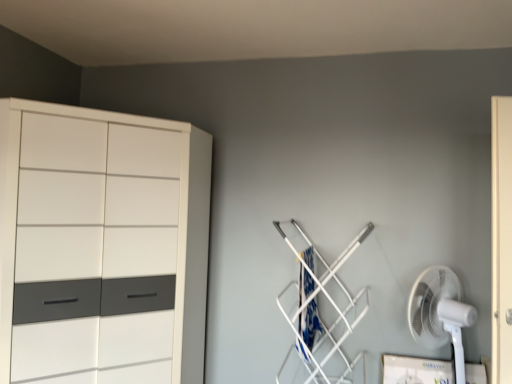
Question: From a real-world perspective, is white plastic fan at lower right under white glossy cupboard at left?

Choices:
 (A) no
 (B) yes

Answer: (B)

Question: Is white plastic fan at lower right located outside white glossy cupboard at left?

Choices:
 (A) yes
 (B) no

Answer: (A)

Question: Is white plastic fan at lower right not close to white glossy cupboard at left?

Choices:
 (A) yes
 (B) no

Answer: (A)

Question: Considering the relative sizes of white plastic fan at lower right and white glossy cupboard at left in the image provided, is white plastic fan at lower right wider than white glossy cupboard at left?

Choices:
 (A) yes
 (B) no

Answer: (B)

Question: Considering the relative sizes of white plastic fan at lower right and white glossy cupboard at left in the image provided, is white plastic fan at lower right smaller than white glossy cupboard at left?

Choices:
 (A) no
 (B) yes

Answer: (B)

Question: Looking at their shapes, would you say blue fabric laundry at center-right is wider or thinner than white plastic fan at lower right?

Choices:
 (A) wide
 (B) thin

Answer: (A)

Question: From the image's perspective, is blue fabric laundry at center-right above or below white plastic fan at lower right?

Choices:
 (A) above
 (B) below

Answer: (A)

Question: Considering the positions of blue fabric laundry at center-right and white plastic fan at lower right in the image, is blue fabric laundry at center-right taller or shorter than white plastic fan at lower right?

Choices:
 (A) short
 (B) tall

Answer: (A)

Question: Is point (313, 302) positioned closer to the camera than point (432, 332)?

Choices:
 (A) farther
 (B) closer

Answer: (A)

Question: From the image's perspective, is white plastic fan at lower right located above or below white glossy cupboard at left?

Choices:
 (A) below
 (B) above

Answer: (A)

Question: In the image, is white plastic fan at lower right positioned in front of or behind white glossy cupboard at left?

Choices:
 (A) behind
 (B) front

Answer: (A)

Question: Considering the positions of white plastic fan at lower right and white glossy cupboard at left in the image, is white plastic fan at lower right wider or thinner than white glossy cupboard at left?

Choices:
 (A) wide
 (B) thin

Answer: (B)

Question: Does point (458, 340) appear closer or farther from the camera than point (67, 269)?

Choices:
 (A) closer
 (B) farther

Answer: (B)

Question: From their relative heights in the image, would you say white plastic fan at lower right is taller or shorter than blue fabric laundry at center-right?

Choices:
 (A) short
 (B) tall

Answer: (B)

Question: Do you think white plastic fan at lower right is within blue fabric laundry at center-right, or outside of it?

Choices:
 (A) inside
 (B) outside

Answer: (B)